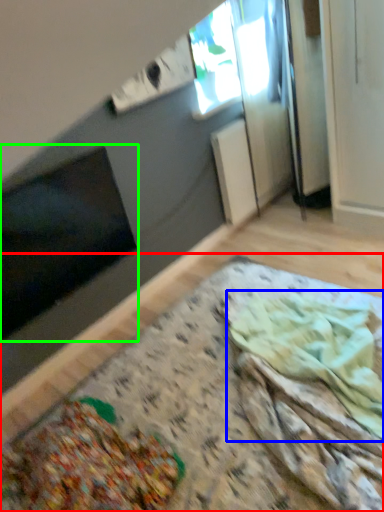
Question: Estimate the real-world distances between objects in this image. Which object is farther from table (highlighted by a red box), food (highlighted by a blue box) or window screen (highlighted by a green box)?

Choices:
 (A) food
 (B) window screen

Answer: (B)